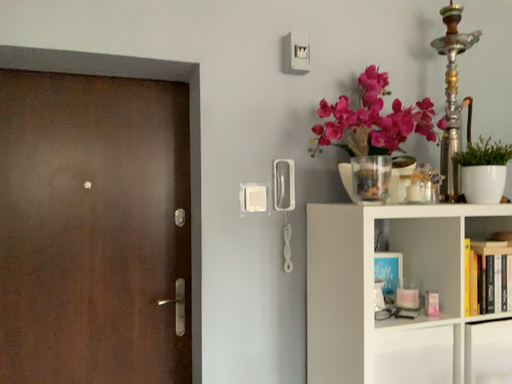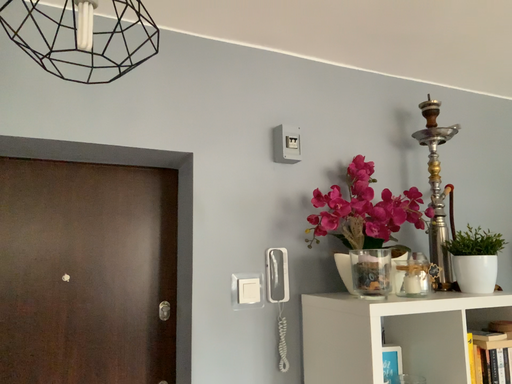
Question: Which way did the camera rotate in the video?

Choices:
 (A) rotated downward
 (B) rotated upward

Answer: (B)